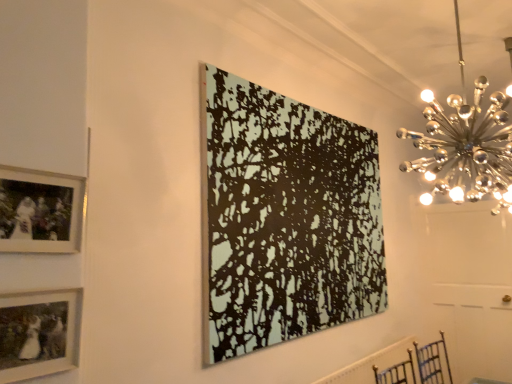
What do you see at coordinates (40, 211) in the screenshot? This screenshot has height=384, width=512. I see `matte silver picture frame at upper left, the second picture frame viewed from the front` at bounding box center [40, 211].

This screenshot has height=384, width=512. What do you see at coordinates (284, 219) in the screenshot? I see `black textured canvas at center, the 1th picture frame positioned from the back` at bounding box center [284, 219].

What do you see at coordinates (465, 144) in the screenshot? The width and height of the screenshot is (512, 384). I see `polished chrome chandelier at upper right` at bounding box center [465, 144].

What is the approximate width of white textured radiator at lower right?

The width of white textured radiator at lower right is 2.57 inches.

Identify the location of matte silver picture frame at upper left, the 3th picture frame viewed from the right. point(40,211).

Between point (377, 366) and point (42, 328), which one is positioned in front?

The point (42, 328) is closer.

From the picture: Is white textured radiator at lower right far away from matte black picture frame at lower left, positioned as the 2th picture frame in left-to-right order?

Absolutely, white textured radiator at lower right is distant from matte black picture frame at lower left, positioned as the 2th picture frame in left-to-right order.

Is white textured radiator at lower right to the left or to the right of matte black picture frame at lower left, arranged as the first picture frame when viewed from the front, in the image?

white textured radiator at lower right is positioned on matte black picture frame at lower left, arranged as the first picture frame when viewed from the front,'s right side.

Could you tell me if white textured radiator at lower right is facing matte black picture frame at lower left, positioned as the 2th picture frame in left-to-right order?

No, white textured radiator at lower right is not oriented towards matte black picture frame at lower left, positioned as the 2th picture frame in left-to-right order.

From the picture: Between matte silver picture frame at upper left, positioned as the second picture frame in back-to-front order, and white textured radiator at lower right, which one appears on the right side from the viewer's perspective?

white textured radiator at lower right is more to the right.

Is matte silver picture frame at upper left, positioned as the second picture frame in back-to-front order, beside white textured radiator at lower right?

No, matte silver picture frame at upper left, positioned as the second picture frame in back-to-front order, is not making contact with white textured radiator at lower right.

From a real-world perspective, which object stands above the other?

matte silver picture frame at upper left, the second picture frame viewed from the front, is physically above.

Where is `radiator on the right of the matte silver picture frame at upper left, the 3th picture frame viewed from the right`? This screenshot has width=512, height=384. radiator on the right of the matte silver picture frame at upper left, the 3th picture frame viewed from the right is located at coordinates (370, 364).

This screenshot has height=384, width=512. What are the coordinates of `radiator that appears behind the polished chrome chandelier at upper right` in the screenshot? It's located at (370, 364).

Is polished chrome chandelier at upper right at the back of white textured radiator at lower right?

No.

Is white textured radiator at lower right not near polished chrome chandelier at upper right?

Absolutely, white textured radiator at lower right is distant from polished chrome chandelier at upper right.

From a real-world perspective, is white textured radiator at lower right located beneath polished chrome chandelier at upper right?

Indeed, from a real-world perspective, white textured radiator at lower right is positioned beneath polished chrome chandelier at upper right.

Based on the photo, considering the relative positions of matte black picture frame at lower left, arranged as the second picture frame when viewed from the right, and polished chrome chandelier at upper right in the image provided, is matte black picture frame at lower left, arranged as the second picture frame when viewed from the right, behind polished chrome chandelier at upper right?

No, the depth of matte black picture frame at lower left, arranged as the second picture frame when viewed from the right, is less than that of polished chrome chandelier at upper right.

Is matte black picture frame at lower left, arranged as the second picture frame when viewed from the right, oriented towards polished chrome chandelier at upper right?

No, matte black picture frame at lower left, arranged as the second picture frame when viewed from the right, is not aimed at polished chrome chandelier at upper right.

Can you confirm if matte black picture frame at lower left, positioned as the 2th picture frame in left-to-right order, is shorter than polished chrome chandelier at upper right?

Yes, matte black picture frame at lower left, positioned as the 2th picture frame in left-to-right order, is shorter than polished chrome chandelier at upper right.

Is matte black picture frame at lower left, the third picture frame in the back-to-front sequence, placed right next to polished chrome chandelier at upper right?

No, matte black picture frame at lower left, the third picture frame in the back-to-front sequence, is not next to polished chrome chandelier at upper right.

Is polished chrome chandelier at upper right positioned beyond the bounds of black textured canvas at center, the 3th picture frame viewed from the left?

Yes, polished chrome chandelier at upper right is outside of black textured canvas at center, the 3th picture frame viewed from the left.

Is polished chrome chandelier at upper right not close to black textured canvas at center, the 1th picture frame positioned from the back?

polished chrome chandelier at upper right is far away from black textured canvas at center, the 1th picture frame positioned from the back.

From a real-world perspective, is polished chrome chandelier at upper right positioned above or below black textured canvas at center, which appears as the 1th picture frame when viewed from the right?

In terms of real-world spatial position, polished chrome chandelier at upper right is above black textured canvas at center, which appears as the 1th picture frame when viewed from the right.

Does polished chrome chandelier at upper right have a greater width compared to black textured canvas at center, the 3th picture frame viewed from the left?

Yes, polished chrome chandelier at upper right is wider than black textured canvas at center, the 3th picture frame viewed from the left.

Can you see polished chrome chandelier at upper right touching matte black picture frame at lower left, the third picture frame in the back-to-front sequence?

No, polished chrome chandelier at upper right is not next to matte black picture frame at lower left, the third picture frame in the back-to-front sequence.

Which is in front, point (463, 201) or point (52, 291)?

The point (52, 291) is closer.

Does polished chrome chandelier at upper right have a smaller size compared to matte black picture frame at lower left, arranged as the first picture frame when viewed from the front?

Incorrect, polished chrome chandelier at upper right is not smaller in size than matte black picture frame at lower left, arranged as the first picture frame when viewed from the front.

Between polished chrome chandelier at upper right and matte black picture frame at lower left, positioned as the 2th picture frame in left-to-right order, which one appears on the right side from the viewer's perspective?

polished chrome chandelier at upper right is more to the right.

Between matte silver picture frame at upper left, which is counted as the first picture frame, starting from the left, and matte black picture frame at lower left, positioned as the 2th picture frame in left-to-right order, which one has smaller size?

matte black picture frame at lower left, positioned as the 2th picture frame in left-to-right order.

Between matte silver picture frame at upper left, the 3th picture frame viewed from the right, and matte black picture frame at lower left, arranged as the first picture frame when viewed from the front, which one appears on the left side from the viewer's perspective?

Positioned to the left is matte silver picture frame at upper left, the 3th picture frame viewed from the right.

The image size is (512, 384). In order to click on picture frame below the matte silver picture frame at upper left, which is counted as the first picture frame, starting from the left (from a real-world perspective) in this screenshot , I will do `click(39, 333)`.

Is matte silver picture frame at upper left, which is counted as the first picture frame, starting from the left, touching matte black picture frame at lower left, arranged as the first picture frame when viewed from the front?

No, matte silver picture frame at upper left, which is counted as the first picture frame, starting from the left, is not in contact with matte black picture frame at lower left, arranged as the first picture frame when viewed from the front.

The width and height of the screenshot is (512, 384). What are the coordinates of `the 1st picture frame positioned above the white textured radiator at lower right (from a real-world perspective)` in the screenshot? It's located at (39, 333).

The height and width of the screenshot is (384, 512). Find the location of `the 3rd picture frame counting from the left of the white textured radiator at lower right`. the 3rd picture frame counting from the left of the white textured radiator at lower right is located at coordinates (40, 211).

Which object lies nearer to the anchor point polished chrome chandelier at upper right, matte silver picture frame at upper left, which is counted as the first picture frame, starting from the left, or matte black picture frame at lower left, positioned as the 2th picture frame in left-to-right order?

The object closer to polished chrome chandelier at upper right is matte silver picture frame at upper left, which is counted as the first picture frame, starting from the left.

Which object lies further to the anchor point matte black picture frame at lower left, arranged as the second picture frame when viewed from the right, white textured radiator at lower right or black textured canvas at center, the third picture frame when ordered from front to back?

white textured radiator at lower right lies further to matte black picture frame at lower left, arranged as the second picture frame when viewed from the right, than the other object.

Based on their spatial positions, is black textured canvas at center, the 1th picture frame positioned from the back, or white textured radiator at lower right closer to matte black picture frame at lower left, positioned as the 2th picture frame in left-to-right order?

black textured canvas at center, the 1th picture frame positioned from the back, is closer to matte black picture frame at lower left, positioned as the 2th picture frame in left-to-right order.

Estimate the real-world distances between objects in this image. Which object is further from white textured radiator at lower right, matte silver picture frame at upper left, positioned as the second picture frame in back-to-front order, or polished chrome chandelier at upper right?

matte silver picture frame at upper left, positioned as the second picture frame in back-to-front order, is further to white textured radiator at lower right.

Estimate the real-world distances between objects in this image. Which object is closer to matte silver picture frame at upper left, the second picture frame viewed from the front, black textured canvas at center, which appears as the 1th picture frame when viewed from the right, or matte black picture frame at lower left, arranged as the second picture frame when viewed from the right?

Based on the image, matte black picture frame at lower left, arranged as the second picture frame when viewed from the right, appears to be nearer to matte silver picture frame at upper left, the second picture frame viewed from the front.

Based on their spatial positions, is black textured canvas at center, the 3th picture frame viewed from the left, or polished chrome chandelier at upper right further from matte black picture frame at lower left, positioned as the 2th picture frame in left-to-right order?

Based on the image, polished chrome chandelier at upper right appears to be further to matte black picture frame at lower left, positioned as the 2th picture frame in left-to-right order.

In the scene shown: Based on their spatial positions, is white textured radiator at lower right or black textured canvas at center, which appears as the 1th picture frame when viewed from the right, closer to matte silver picture frame at upper left, which is counted as the first picture frame, starting from the left?

black textured canvas at center, which appears as the 1th picture frame when viewed from the right, lies closer to matte silver picture frame at upper left, which is counted as the first picture frame, starting from the left, than the other object.

When comparing their distances from black textured canvas at center, the 1th picture frame positioned from the back, does matte black picture frame at lower left, positioned as the 2th picture frame in left-to-right order, or matte silver picture frame at upper left, positioned as the second picture frame in back-to-front order, seem closer?

matte silver picture frame at upper left, positioned as the second picture frame in back-to-front order, is closer to black textured canvas at center, the 1th picture frame positioned from the back.

The image size is (512, 384). I want to click on picture frame between matte silver picture frame at upper left, positioned as the second picture frame in back-to-front order, and white textured radiator at lower right in the front-back direction, so click(x=284, y=219).

Find the location of a particular element. The width and height of the screenshot is (512, 384). picture frame between matte silver picture frame at upper left, the 3th picture frame viewed from the right, and black textured canvas at center, the third picture frame when ordered from front to back, from left to right is located at coordinates (39, 333).

Locate an element on the screen. picture frame situated between matte black picture frame at lower left, the third picture frame in the back-to-front sequence, and polished chrome chandelier at upper right from left to right is located at coordinates (284, 219).